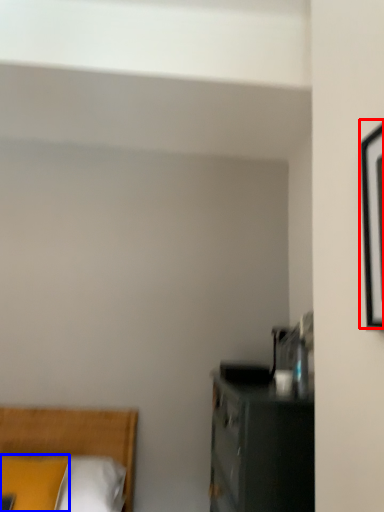
Question: Which of the following is the farthest to the observer, picture frame (highlighted by a red box) or pillow (highlighted by a blue box)?

Choices:
 (A) picture frame
 (B) pillow

Answer: (B)